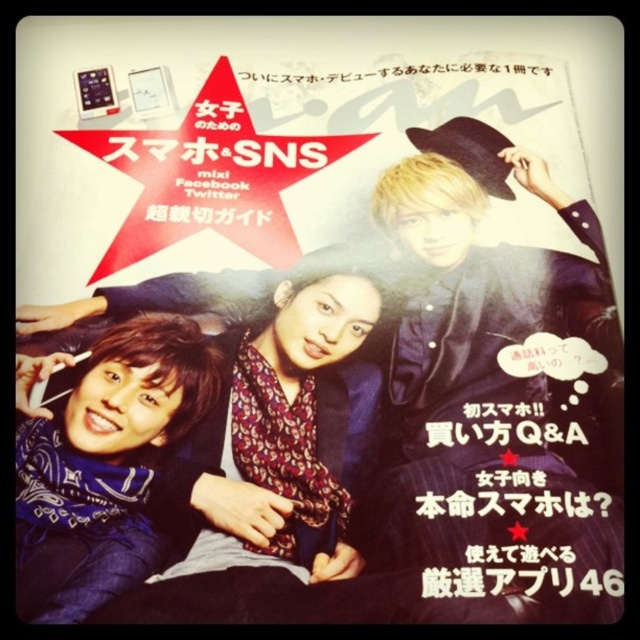
Question: Among these objects, which one is farthest from the camera?

Choices:
 (A) blacktextured paperposter at upper center
 (B) blue bandana at lower left
 (C) black pinstriped suit at upper right
 (D) printed scarf at center

Answer: (D)

Question: Is printed scarf at center below blue bandana at lower left?

Choices:
 (A) no
 (B) yes

Answer: (A)

Question: Does blue bandana at lower left appear under blacktextured paperposter at upper center?

Choices:
 (A) yes
 (B) no

Answer: (B)

Question: Observing the image, what is the correct spatial positioning of black pinstriped suit at upper right in reference to printed scarf at center?

Choices:
 (A) below
 (B) above

Answer: (B)

Question: Which point is farther from the camera taking this photo?

Choices:
 (A) (536, 497)
 (B) (529, 301)
 (C) (144, 540)

Answer: (B)

Question: Which point is closer to the camera?

Choices:
 (A) (118, 461)
 (B) (506, 362)

Answer: (A)